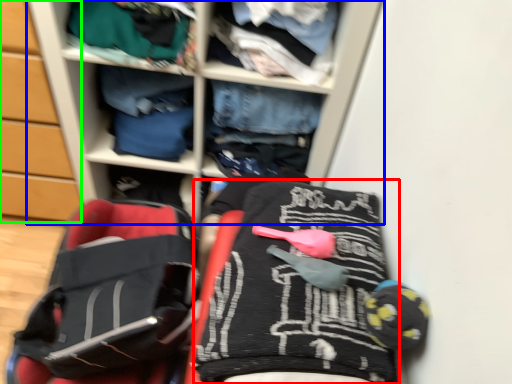
Question: Estimate the real-world distances between objects in this image. Which object is closer to clothing (highlighted by a red box), shelf (highlighted by a blue box) or cabinetry (highlighted by a green box)?

Choices:
 (A) shelf
 (B) cabinetry

Answer: (A)